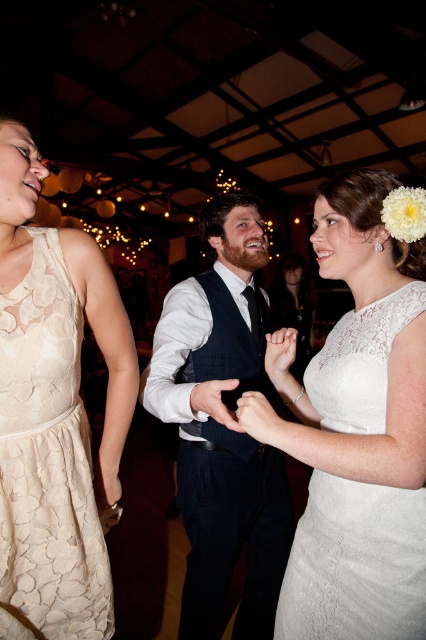
How far apart are lace white dress at center and white lace dress at center?

lace white dress at center and white lace dress at center are 2.47 meters apart from each other.

Is lace white dress at center bigger than white lace dress at center?

Incorrect, lace white dress at center is not larger than white lace dress at center.

Identify the location of lace white dress at center. (354, 563).

Does point (152, 408) come behind point (8, 300)?

Yes, point (152, 408) is farther from viewer.

Identify the location of dark blue textured vest at center. This screenshot has height=640, width=426. (222, 426).

Is point (232, 493) behind point (74, 506)?

Yes, it is behind point (74, 506).

Where is `dark blue textured vest at center`? The image size is (426, 640). dark blue textured vest at center is located at coordinates (222, 426).

Is lace fabric dress at left positioned in front of lace white dress at center?

No, lace fabric dress at left is further to the viewer.

Is lace fabric dress at left thinner than lace white dress at center?

Yes, lace fabric dress at left is thinner than lace white dress at center.

Does point (48, 243) come closer to viewer compared to point (397, 330)?

No.

The image size is (426, 640). I want to click on lace fabric dress at left, so click(48, 464).